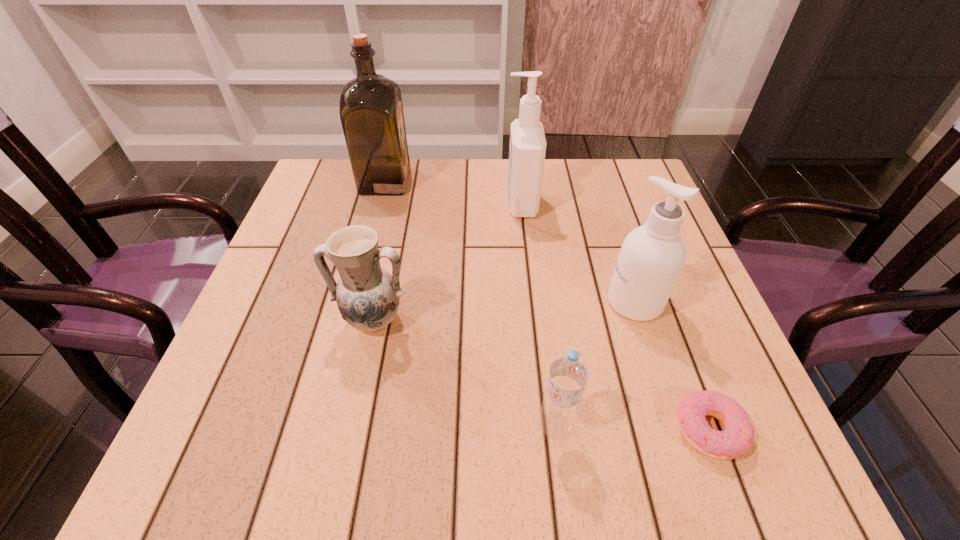
Identify the location of doughnut that is at the near edge. (738, 436).

Find the location of `object that is at the left edge`. object that is at the left edge is located at coordinates (371, 111).

You are a GUI agent. You are given a task and a screenshot of the screen. Output one action in this format:
    pyautogui.click(x=<x>, y=<y>)
    Task: Click on the cleansing agent that is at the right edge
    This screenshot has width=960, height=540.
    Given the screenshot: What is the action you would take?
    pyautogui.click(x=652, y=256)

In order to click on doughnut located in the right edge section of the desktop in this screenshot , I will do `click(738, 436)`.

Locate an element on the screen. The height and width of the screenshot is (540, 960). object that is at the far left corner is located at coordinates (371, 111).

Find the location of a particular element. Image resolution: width=960 pixels, height=540 pixels. object present at the near right corner is located at coordinates (738, 436).

I want to click on blank area at the far edge, so click(x=568, y=161).

Locate an element on the screen. Image resolution: width=960 pixels, height=540 pixels. vacant space at the near edge of the desktop is located at coordinates (382, 460).

In the image, there is a desktop. In order to click on vacant space at the left edge in this screenshot , I will do `click(256, 326)`.

Where is `vacant area at the right edge of the desktop`? This screenshot has width=960, height=540. vacant area at the right edge of the desktop is located at coordinates (721, 390).